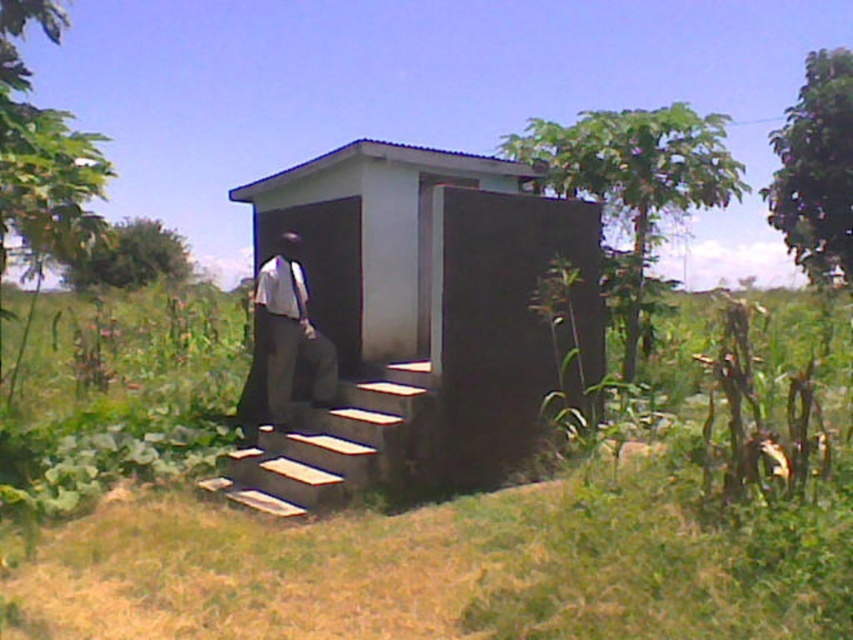
In the scene shown: Does white shirt at center appear over white fabric tie at center?

Actually, white shirt at center is below white fabric tie at center.

Between white shirt at center and white fabric tie at center, which one has more height?

Standing taller between the two is white shirt at center.

Does point (265, 364) come behind point (294, 282)?

Yes, point (265, 364) is behind point (294, 282).

Locate an element on the screen. white shirt at center is located at coordinates (285, 340).

Does concrete block hut at center appear under white fabric tie at center?

Incorrect, concrete block hut at center is not positioned below white fabric tie at center.

Can you confirm if concrete block hut at center is shorter than white fabric tie at center?

In fact, concrete block hut at center may be taller than white fabric tie at center.

Locate an element on the screen. concrete block hut at center is located at coordinates (426, 307).

Does concrete block hut at center have a larger size compared to white shirt at center?

Yes.

Does concrete block hut at center come behind white shirt at center?

No, it is not.

This screenshot has height=640, width=853. Find the location of `concrete block hut at center`. concrete block hut at center is located at coordinates (426, 307).